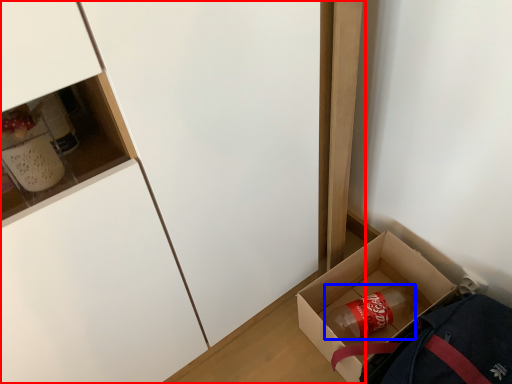
Question: Among these objects, which one is nearest to the camera, cabinetry (highlighted by a red box) or beverage (highlighted by a blue box)?

Choices:
 (A) cabinetry
 (B) beverage

Answer: (A)